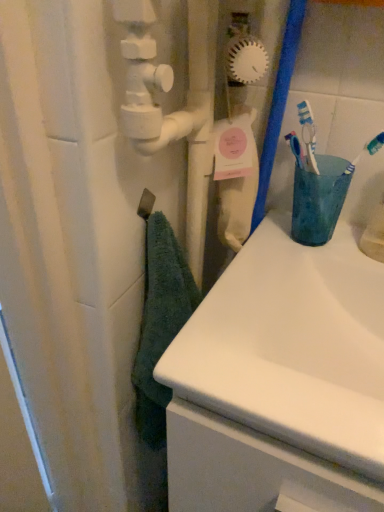
Describe the element at coordinates (319, 199) in the screenshot. This screenshot has width=384, height=512. I see `matte plastic cup at right` at that location.

Locate an element on the screen. matte plastic cup at right is located at coordinates tap(319, 199).

Where is `teal soft towel at left`? teal soft towel at left is located at coordinates (160, 323).

In the scene shown: From the image's perspective, is white glossy sink at center positioned above or below teal soft towel at left?

white glossy sink at center is below teal soft towel at left.

Is white glossy sink at center aimed at teal soft towel at left?

No, white glossy sink at center does not turn towards teal soft towel at left.

Is point (345, 337) closer or farther from the camera than point (135, 409)?

Clearly, point (345, 337) is closer to the camera than point (135, 409).

Is point (338, 341) positioned behind point (326, 192)?

Yes, it is behind point (326, 192).

How far apart are white glossy sink at center and matte plastic cup at right?

white glossy sink at center and matte plastic cup at right are 6.22 inches apart.

Can you confirm if white glossy sink at center is taller than matte plastic cup at right?

Indeed, white glossy sink at center has a greater height compared to matte plastic cup at right.

You are a GUI agent. You are given a task and a screenshot of the screen. Output one action in this format:
    pyautogui.click(x=<x>, y=<y>)
    Task: Click on the sink below the matte plastic cup at right (from a real-world perspective)
    This screenshot has width=384, height=512.
    Given the screenshot: What is the action you would take?
    pyautogui.click(x=292, y=346)

Where is `turquoise behind the white glossy sink at center`? Image resolution: width=384 pixels, height=512 pixels. turquoise behind the white glossy sink at center is located at coordinates (319, 199).

Between matte plastic cup at right and white glossy sink at center, which one has smaller width?

matte plastic cup at right.

Considering the positions of points (309, 204) and (216, 375), is point (309, 204) closer to camera compared to point (216, 375)?

No, it is behind (216, 375).

Looking at their sizes, would you say teal soft towel at left is wider or thinner than matte plastic cup at right?

Clearly, teal soft towel at left has less width compared to matte plastic cup at right.

Measure the distance between teal soft towel at left and matte plastic cup at right.

They are 9.96 inches apart.

From a real-world perspective, is teal soft towel at left beneath matte plastic cup at right?

Yes, from a real-world perspective, teal soft towel at left is beneath matte plastic cup at right.

Is teal soft towel at left far from matte plastic cup at right?

No, there isn't a large distance between teal soft towel at left and matte plastic cup at right.

Which object is closer to the camera taking this photo, teal soft towel at left or white glossy sink at center?

white glossy sink at center is closer to the camera.

Which is in front, point (149, 240) or point (220, 353)?

The point (220, 353) is closer to the camera.

Looking at this image, how distant is teal soft towel at left from white glossy sink at center?

teal soft towel at left and white glossy sink at center are 6.25 inches apart from each other.

From the image's perspective, is teal soft towel at left on top of white glossy sink at center?

Yes, from the image's perspective, teal soft towel at left is on top of white glossy sink at center.

Is matte plastic cup at right with teal soft towel at left?

matte plastic cup at right and teal soft towel at left are clearly separated.

Considering the relative positions of matte plastic cup at right and teal soft towel at left in the image provided, is matte plastic cup at right to the right of teal soft towel at left from the viewer's perspective?

Yes.

Is matte plastic cup at right surrounding teal soft towel at left?

No, teal soft towel at left is not surrounded by matte plastic cup at right.

The width and height of the screenshot is (384, 512). In order to click on sink lying in front of the teal soft towel at left in this screenshot , I will do `click(292, 346)`.

In the image, there is a white glossy sink at center. Find the location of `turquoise above it (from the image's perspective)`. turquoise above it (from the image's perspective) is located at coordinates (319, 199).

Based on their spatial positions, is white glossy sink at center or matte plastic cup at right further from teal soft towel at left?

matte plastic cup at right lies further to teal soft towel at left than the other object.

Considering their positions, is teal soft towel at left positioned further to matte plastic cup at right than white glossy sink at center?

Among the two, teal soft towel at left is located further to matte plastic cup at right.

Looking at the image, which one is located further to matte plastic cup at right, white glossy sink at center or teal soft towel at left?

teal soft towel at left lies further to matte plastic cup at right than the other object.

From the image, which object appears to be nearer to white glossy sink at center, matte plastic cup at right or teal soft towel at left?

matte plastic cup at right is positioned closer to the anchor white glossy sink at center.

Which object lies nearer to the anchor point teal soft towel at left, matte plastic cup at right or white glossy sink at center?

Among the two, white glossy sink at center is located nearer to teal soft towel at left.

Estimate the real-world distances between objects in this image. Which object is closer to white glossy sink at center, teal soft towel at left or matte plastic cup at right?

Among the two, matte plastic cup at right is located nearer to white glossy sink at center.

This screenshot has width=384, height=512. Identify the location of bath towel between matte plastic cup at right and white glossy sink at center in the vertical direction. (160, 323).